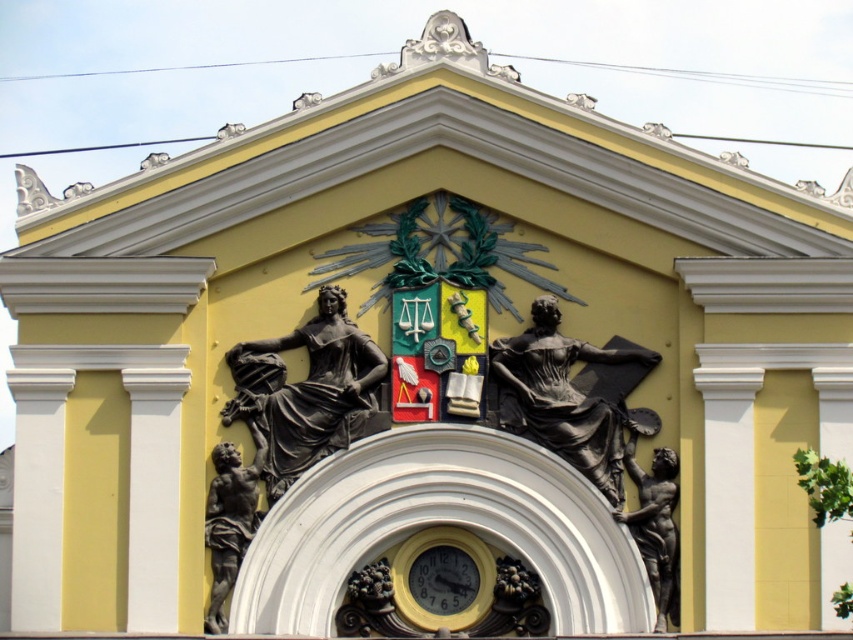
You are a GUI agent. You are given a task and a screenshot of the screen. Output one action in this format:
    pyautogui.click(x=<x>, y=<y>)
    Task: Click on the black polished statue at center
    
    Given the screenshot: What is the action you would take?
    pyautogui.click(x=308, y=392)

Is point (248, 392) less distant than point (229, 481)?

No.

This screenshot has height=640, width=853. I want to click on black polished statue at center, so click(x=308, y=392).

Between metallic gold clock at center and metallic clock face at center, which one is positioned lower?

Positioned lower is metallic gold clock at center.

Is metallic gold clock at center bigger than metallic clock face at center?

Actually, metallic gold clock at center might be smaller than metallic clock face at center.

Between point (486, 566) and point (444, 570), which one is positioned in front?

Point (486, 566)

Identify the location of metallic gold clock at center. (444, 579).

Find the location of a particular element. bronze statue at right is located at coordinates (654, 525).

Does bronze statue at right appear on the left side of metallic clock face at center?

Incorrect, bronze statue at right is not on the left side of metallic clock face at center.

Which is behind, point (657, 593) or point (422, 572)?

The point (422, 572) is more distant.

The width and height of the screenshot is (853, 640). Find the location of `bronze statue at right`. bronze statue at right is located at coordinates (654, 525).